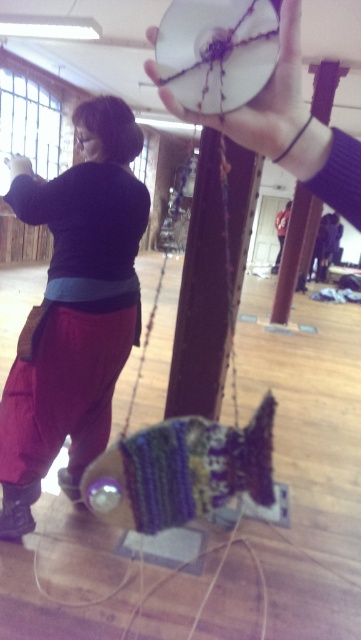
Can you confirm if matte black sweater at left is thinner than white matte disc at upper center?

No, matte black sweater at left is not thinner than white matte disc at upper center.

Is matte black sweater at left shorter than white matte disc at upper center?

No.

This screenshot has width=361, height=640. What do you see at coordinates (74, 310) in the screenshot?
I see `matte black sweater at left` at bounding box center [74, 310].

I want to click on matte black sweater at left, so click(x=74, y=310).

Which is more to the right, matte black sweater at left or matte black hand at upper center?

Positioned to the right is matte black sweater at left.

What do you see at coordinates (74, 310) in the screenshot? The width and height of the screenshot is (361, 640). I see `matte black sweater at left` at bounding box center [74, 310].

At what (x,y) coordinates should I click in order to perform the action: click on matte black sweater at left. Please return your answer as a coordinate pair (x, y). Looking at the image, I should click on (74, 310).

Measure the distance between white matte disc at upper center and camera.

white matte disc at upper center is 18.42 inches away from camera.

Is white matte disc at upper center taller than matte black hand at upper center?

Yes, white matte disc at upper center is taller than matte black hand at upper center.

Does point (158, 77) come farther from viewer compared to point (18, 168)?

No.

I want to click on white matte disc at upper center, so click(x=151, y=35).